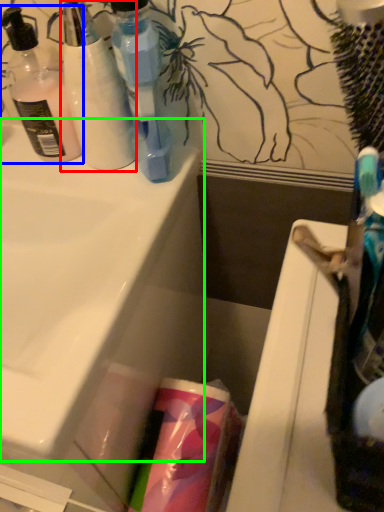
Question: Considering the real-world distances, which object is farthest from bottle (highlighted by a red box)? bottle (highlighted by a blue box) or sink (highlighted by a green box)?

Choices:
 (A) bottle
 (B) sink

Answer: (B)